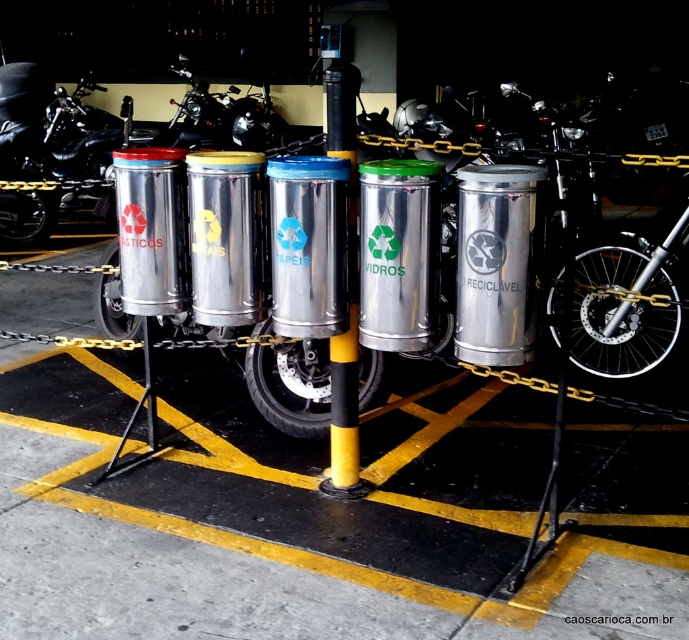
Describe the element at coordinates (344, 412) in the screenshot. I see `yellow matte pole at center` at that location.

Is yellow matte pole at center wider than brushed metal motorcycle at center?

No, yellow matte pole at center is not wider than brushed metal motorcycle at center.

Image resolution: width=689 pixels, height=640 pixels. Identify the location of yellow matte pole at center. (344, 412).

Consider the image. Is shiny black motorcycle at center closer to camera compared to yellow matte pole at center?

No.

Does point (52, 106) lie behind point (336, 486)?

That is True.

Who is more forward, (88, 122) or (338, 70)?

Point (338, 70) is more forward.

Where is `shiny black motorcycle at center`? This screenshot has height=640, width=689. shiny black motorcycle at center is located at coordinates (51, 154).

Can you confirm if shiny black motorcycle at center is smaller than brushed metal motorcycle at center?

Incorrect, shiny black motorcycle at center is not smaller in size than brushed metal motorcycle at center.

The image size is (689, 640). Identify the location of shiny black motorcycle at center. (51, 154).

Describe the element at coordinates (51, 154) in the screenshot. I see `shiny black motorcycle at center` at that location.

Identify the location of shiny black motorcycle at center. This screenshot has height=640, width=689. (51, 154).